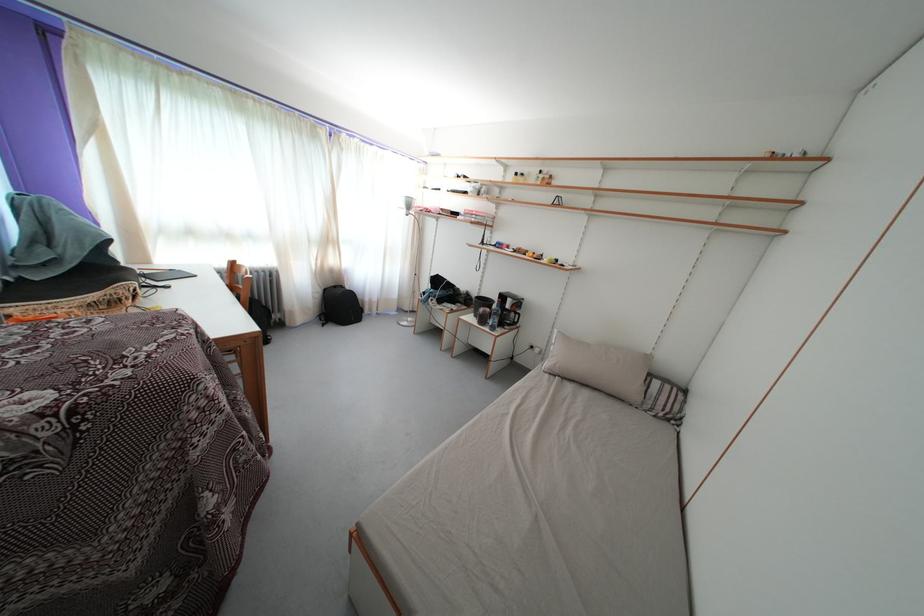
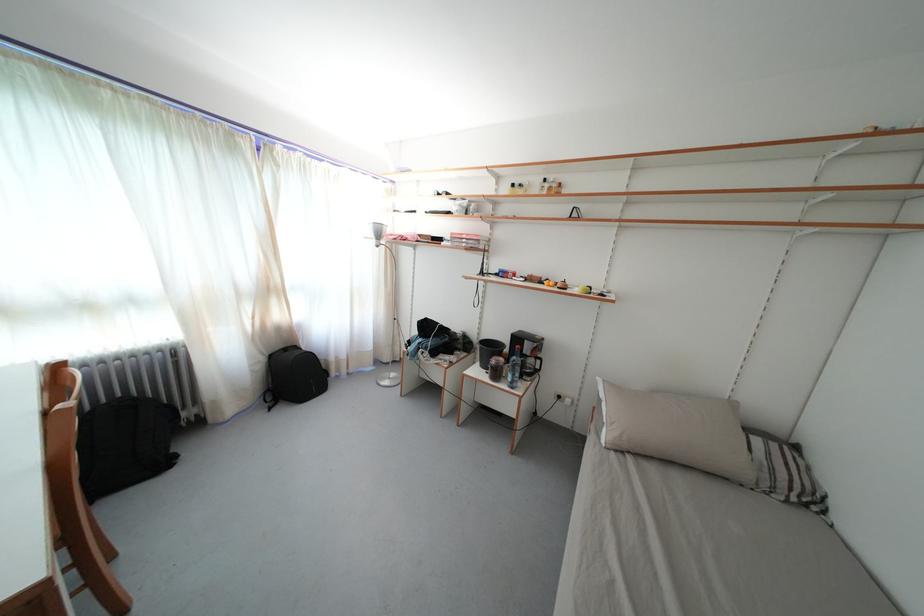
The point at (x=409, y=212) is marked in the first image. Where is the corresponding point in the second image?

(378, 241)